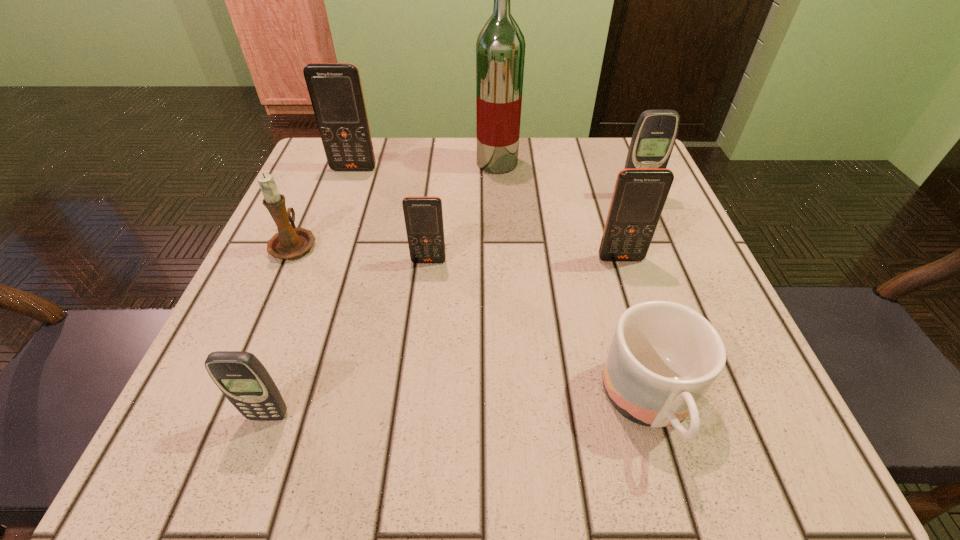
Identify which orange cellular telephone is the second closest to the farthest orange cellular telephone. Please provide its 2D coordinates. Your answer should be formatted as a tuple, i.e. [(x, y)], where the tuple contains the x and y coordinates of a point satisfying the conditions above.

[(639, 196)]